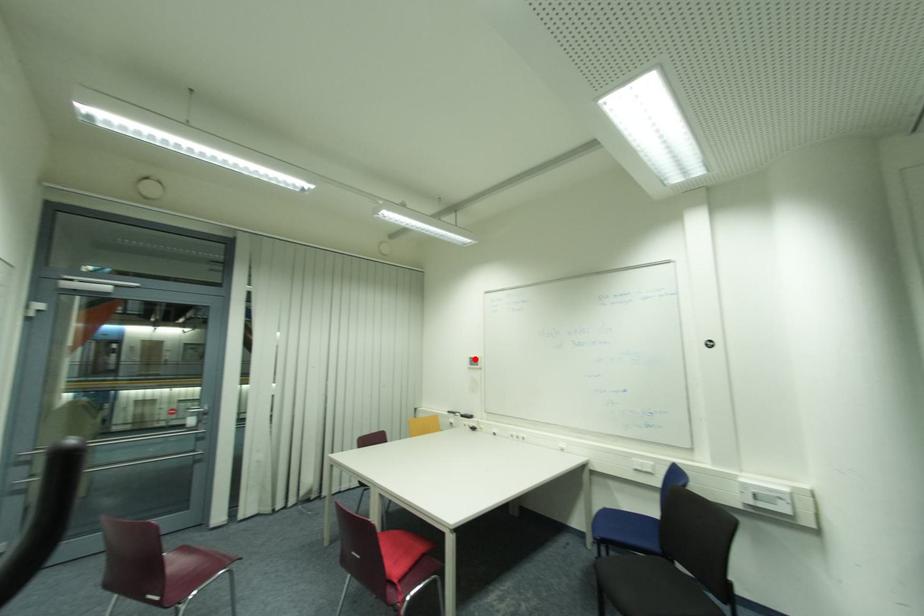
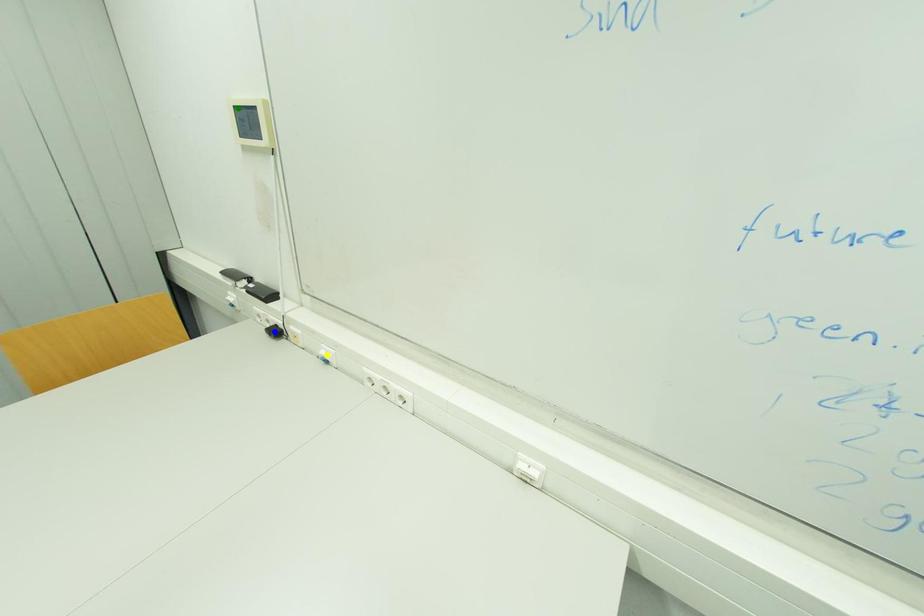
Question: I am providing you with two images of the same scene from different viewpoints. A red point is marked on the first image. You are given multiple points on the second image. Which mark in image 2 goes with the point in image 1?

Choices:
 (A) blue point
 (B) green point
 (C) yellow point

Answer: (B)